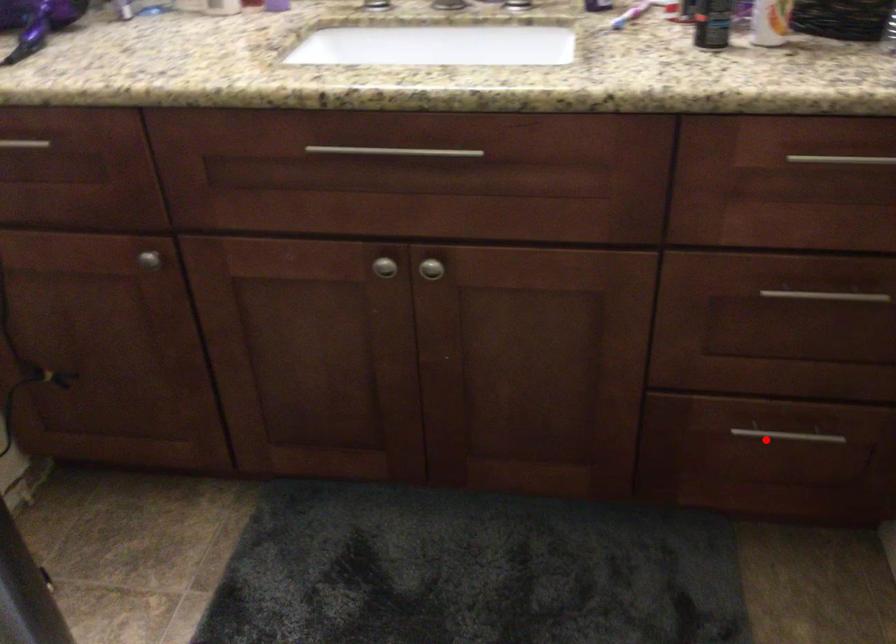
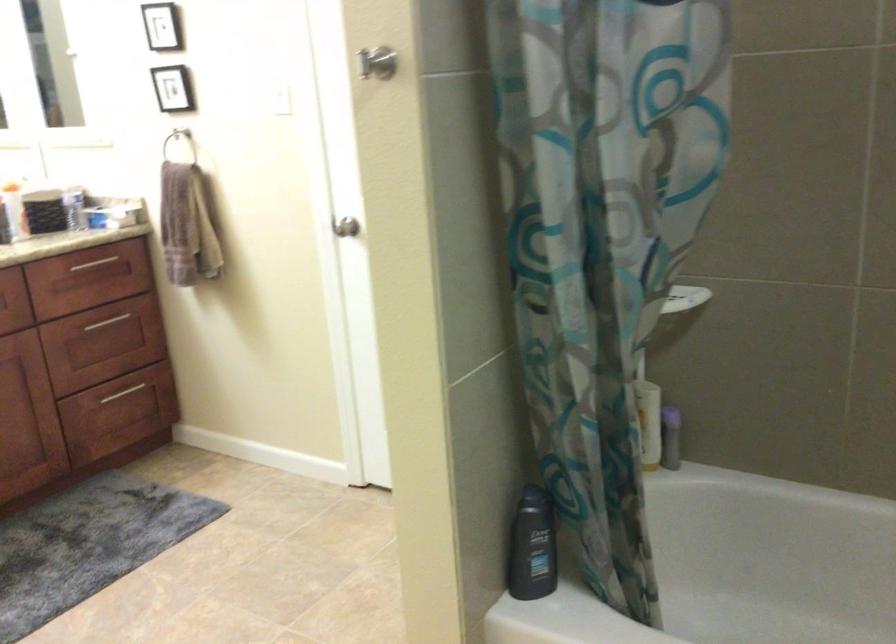
In the second image, find the point that corresponds to the highlighted location in the first image.

(122, 393)